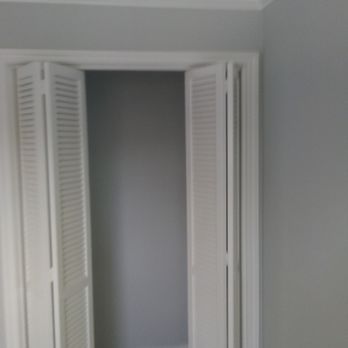
Where is `wall (in closet)`? wall (in closet) is located at coordinates (134, 123).